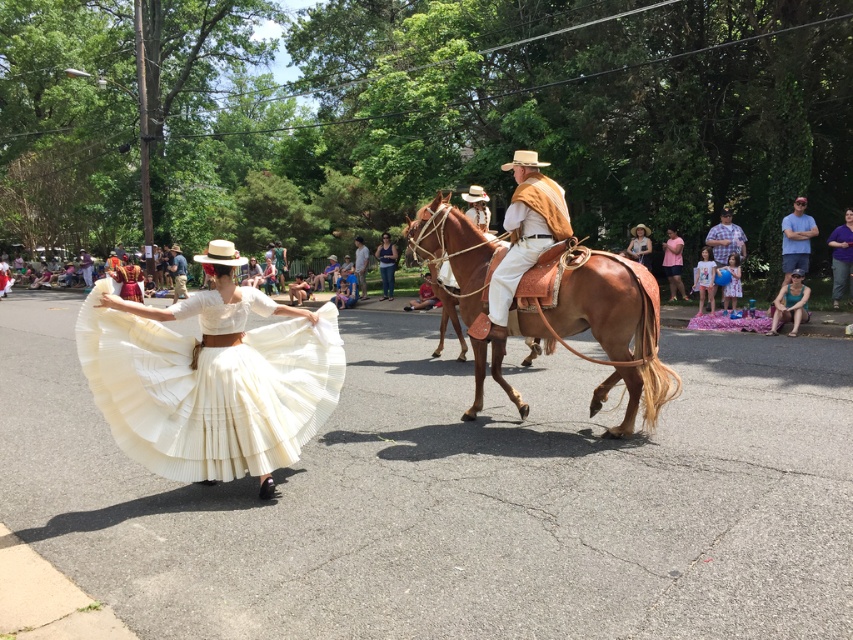
Between pink cotton dress at center and blue denim shirt at center, which one appears on the right side from the viewer's perspective?

pink cotton dress at center is more to the right.

Between point (677, 291) and point (173, 284), which one is positioned in front?

Positioned in front is point (677, 291).

The height and width of the screenshot is (640, 853). What are the coordinates of `pink cotton dress at center` in the screenshot? It's located at (672, 262).

Is point (805, 248) positioned after point (834, 307)?

That is True.

Between blue denim shirt at right and purple cotton shirt at center, which one is positioned lower?

purple cotton shirt at center is below.

The height and width of the screenshot is (640, 853). I want to click on blue denim shirt at right, so click(x=796, y=237).

This screenshot has width=853, height=640. I want to click on blue denim shirt at right, so click(x=796, y=237).

Between white pleated skirt at center and purple cotton shirt at center, which one has more height?

With more height is purple cotton shirt at center.

Image resolution: width=853 pixels, height=640 pixels. What do you see at coordinates (209, 390) in the screenshot? I see `white pleated skirt at center` at bounding box center [209, 390].

Locate an element on the screen. The width and height of the screenshot is (853, 640). white pleated skirt at center is located at coordinates (209, 390).